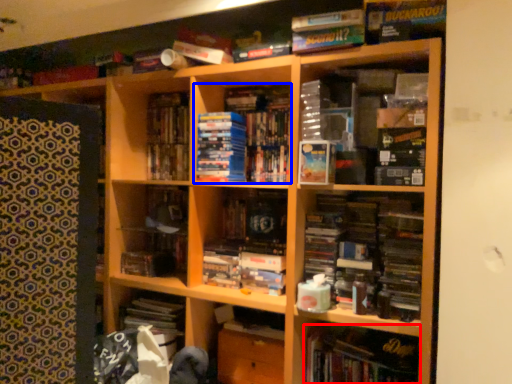
Question: Among these objects, which one is nearest to the camera, book (highlighted by a red box) or book (highlighted by a blue box)?

Choices:
 (A) book
 (B) book

Answer: (A)